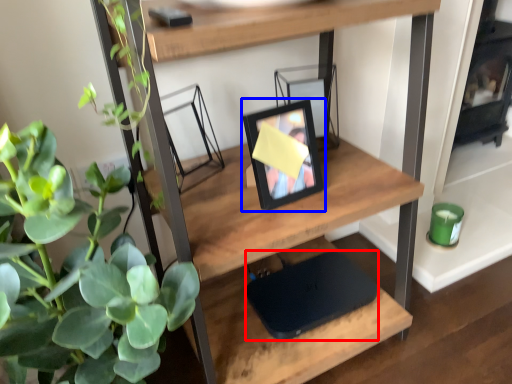
Question: Which of the following is the closest to the observer, laptop (highlighted by a red box) or picture frame (highlighted by a blue box)?

Choices:
 (A) laptop
 (B) picture frame

Answer: (B)